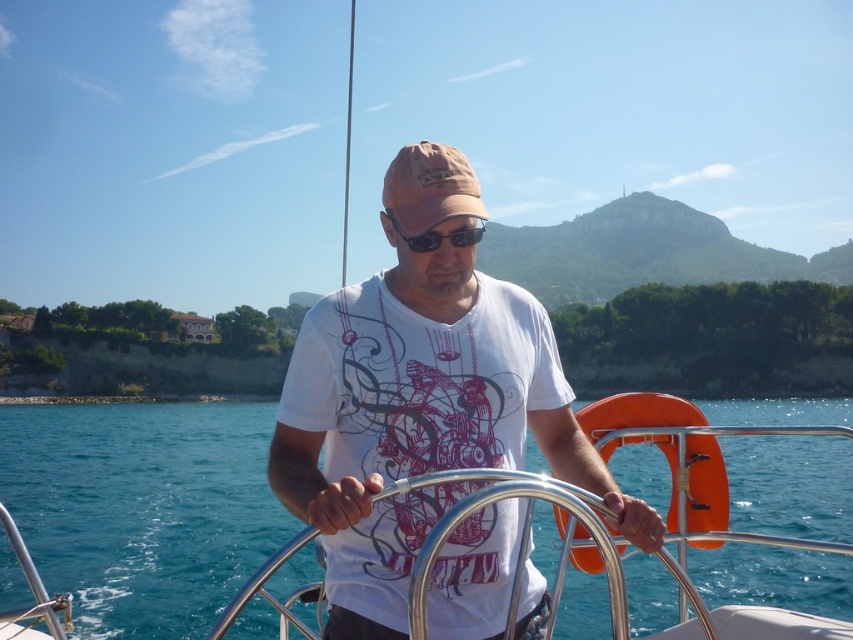
You are on a boat and want to locate the clear blue water at center. According to the coordinates provided, where exactly should you look?

You should look at point (142, 508) to find the clear blue water at center.